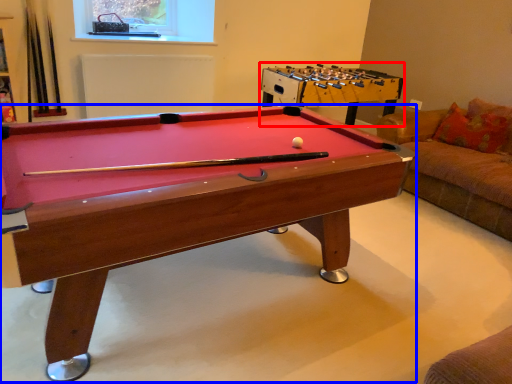
Question: Which object appears farthest to the camera in this image, table (highlighted by a red box) or billiard table (highlighted by a blue box)?

Choices:
 (A) table
 (B) billiard table

Answer: (A)